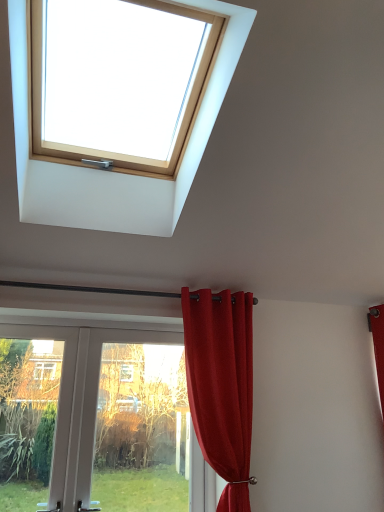
Question: From the image's perspective, is wooden skylight at upper center under white plastic door at lower left?

Choices:
 (A) yes
 (B) no

Answer: (B)

Question: Is wooden skylight at upper center at the right side of white plastic door at lower left?

Choices:
 (A) no
 (B) yes

Answer: (B)

Question: From the image's perspective, does wooden skylight at upper center appear higher than white plastic door at lower left?

Choices:
 (A) no
 (B) yes

Answer: (B)

Question: Is wooden skylight at upper center far away from white plastic door at lower left?

Choices:
 (A) yes
 (B) no

Answer: (A)

Question: Is wooden skylight at upper center taller than white plastic door at lower left?

Choices:
 (A) no
 (B) yes

Answer: (A)

Question: Is point (26, 120) positioned closer to the camera than point (117, 473)?

Choices:
 (A) farther
 (B) closer

Answer: (B)

Question: From the image's perspective, is wooden skylight at upper center positioned above or below white plastic door at lower left?

Choices:
 (A) above
 (B) below

Answer: (A)

Question: Considering their positions, is wooden skylight at upper center located in front of or behind white plastic door at lower left?

Choices:
 (A) front
 (B) behind

Answer: (A)

Question: Is wooden skylight at upper center bigger or smaller than white plastic door at lower left?

Choices:
 (A) big
 (B) small

Answer: (A)

Question: From the image's perspective, is white plastic door at lower left positioned above or below wooden skylight at upper center?

Choices:
 (A) below
 (B) above

Answer: (A)

Question: Looking at their shapes, would you say white plastic door at lower left is wider or thinner than wooden skylight at upper center?

Choices:
 (A) wide
 (B) thin

Answer: (B)

Question: From a real-world perspective, is white plastic door at lower left above or below wooden skylight at upper center?

Choices:
 (A) below
 (B) above

Answer: (A)

Question: Looking at the image, does white plastic door at lower left seem bigger or smaller compared to wooden skylight at upper center?

Choices:
 (A) big
 (B) small

Answer: (B)

Question: Considering their positions, is white plastic door at lower left located in front of or behind transparent glass door at lower left?

Choices:
 (A) front
 (B) behind

Answer: (A)

Question: In the image, is white plastic door at lower left on the left side or the right side of transparent glass door at lower left?

Choices:
 (A) right
 (B) left

Answer: (B)